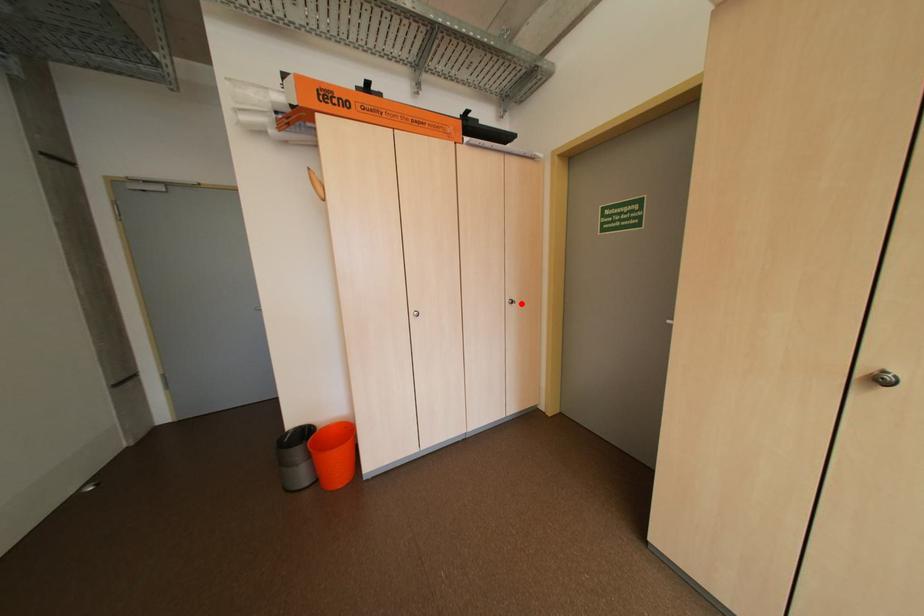
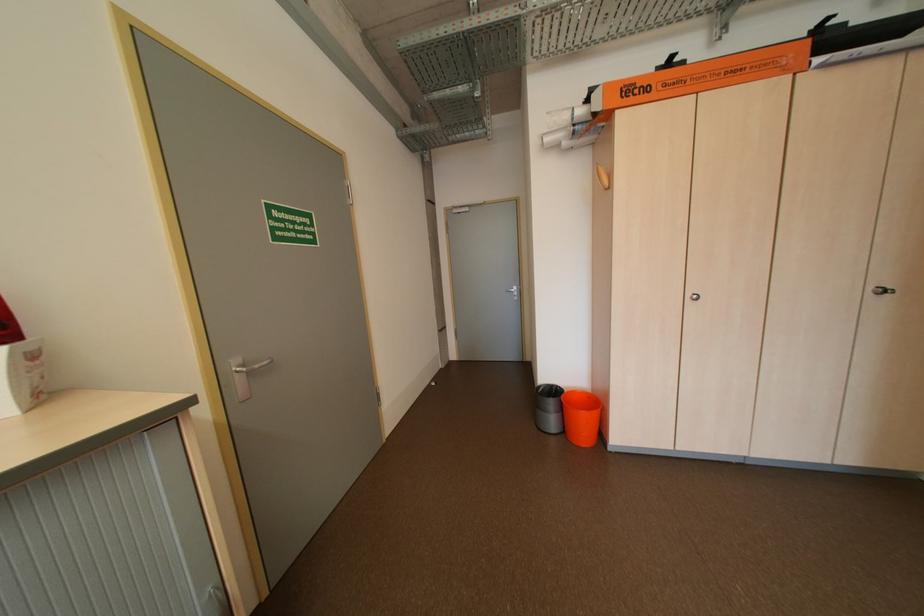
The point at the highlighted location is marked in the first image. Where is the corresponding point in the second image?

(894, 293)